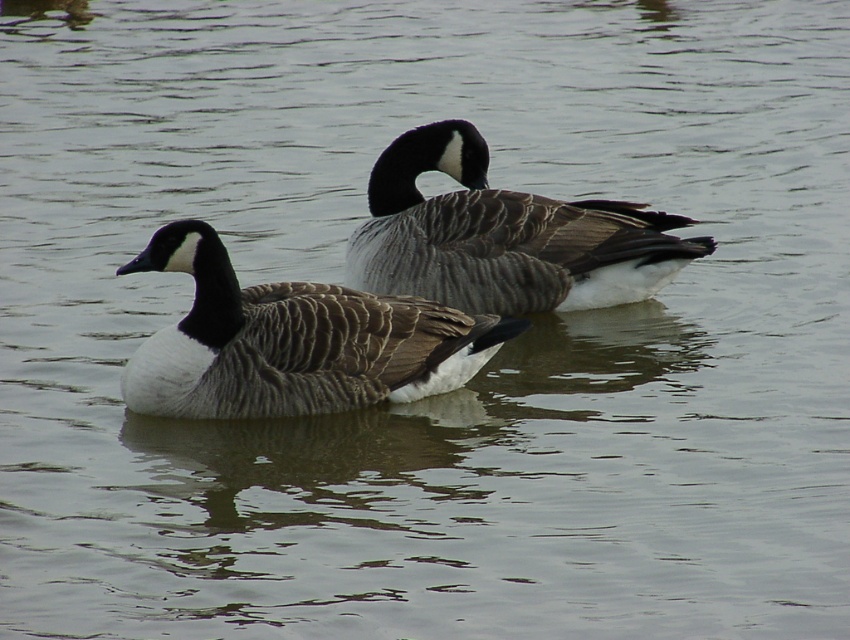
Question: Which point is farther from the camera taking this photo?

Choices:
 (A) (197, 385)
 (B) (503, 257)

Answer: (B)

Question: Can you confirm if brown textured goose at left is thinner than gray feathered goose at center?

Choices:
 (A) no
 (B) yes

Answer: (B)

Question: Is brown textured goose at left behind gray feathered goose at center?

Choices:
 (A) no
 (B) yes

Answer: (A)

Question: Is brown textured goose at left below gray feathered goose at center?

Choices:
 (A) no
 (B) yes

Answer: (B)